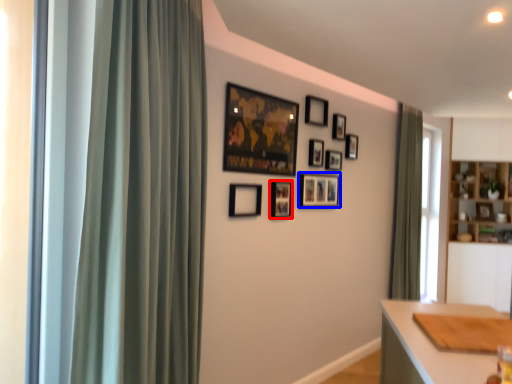
Question: Among these objects, which one is farthest to the camera, picture frame (highlighted by a red box) or picture frame (highlighted by a blue box)?

Choices:
 (A) picture frame
 (B) picture frame

Answer: (B)